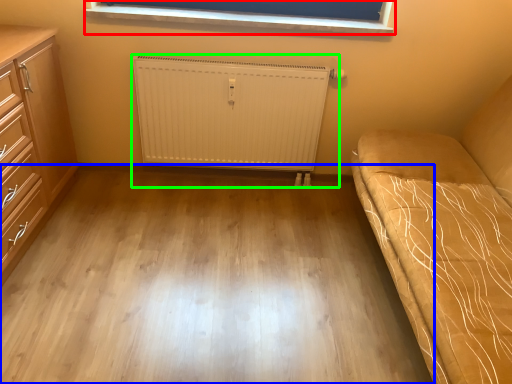
Question: Considering the real-world distances, which object is farthest from window (highlighted by a red box)? plain (highlighted by a blue box) or radiator (highlighted by a green box)?

Choices:
 (A) plain
 (B) radiator

Answer: (A)